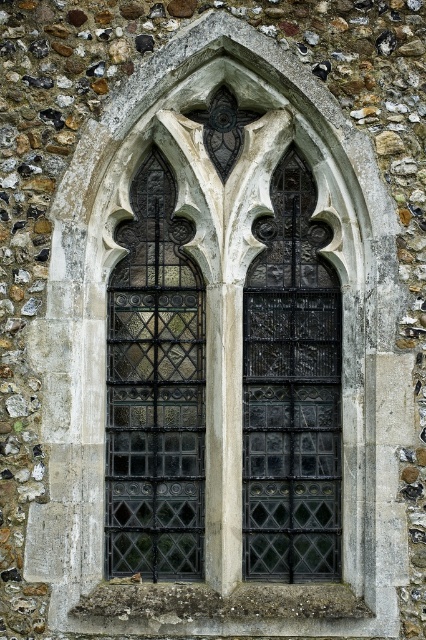
You are an architect designing a new Gothic window. You have two glass panels to choose from in the image. The dark stained glass at left and the black textured glass at center. Which one is wider?

The dark stained glass at left is wider than the black textured glass at center.

Based on the photo, you are an architect examining the Gothic window and want to determine which of the two points, point (138, 170) or point (271, 534), is closer to you. Can you identify the closer one?

Point (138, 170) is closer to you because it is further to the viewer than point (271, 534).

You are an architect examining the Gothic window. You notice the dark stained glass at left and the black textured glass at center. Which glass panel is located higher up in the window?

The dark stained glass at left is positioned over the black textured glass at center, meaning it is higher up in the window.